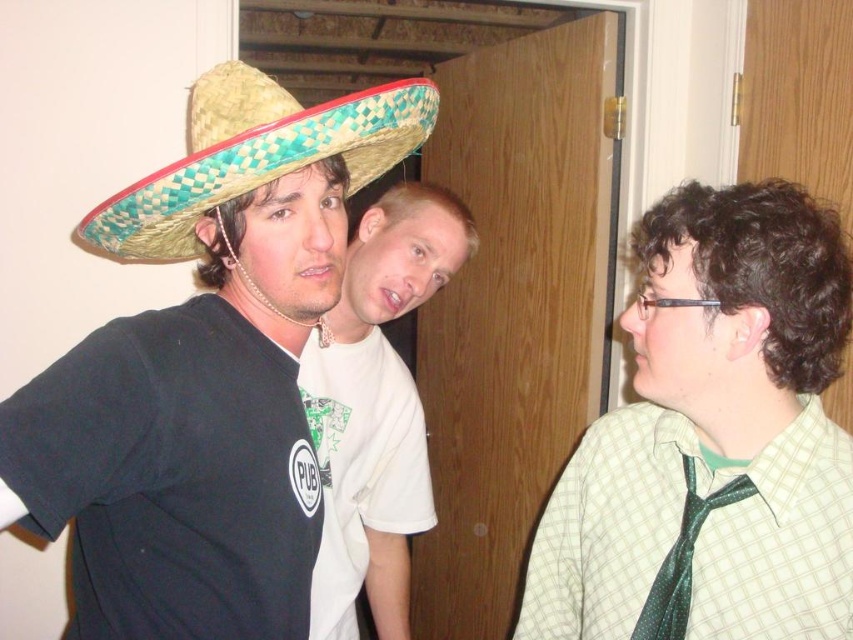
Between white cotton t-shirt at center and woven straw sombrero at upper left, which one is positioned lower?

white cotton t-shirt at center is below.

Can you confirm if white cotton t-shirt at center is positioned to the right of woven straw sombrero at upper left?

Correct, you'll find white cotton t-shirt at center to the right of woven straw sombrero at upper left.

Which is in front, point (347, 621) or point (366, 160)?

Point (366, 160) is in front.

Locate an element on the screen. white cotton t-shirt at center is located at coordinates (376, 408).

Does green shiny tie at right appear over green dotted fabric tie at right?

Yes.

Image resolution: width=853 pixels, height=640 pixels. Find the location of `green shiny tie at right`. green shiny tie at right is located at coordinates (714, 435).

Can you confirm if woven straw sombrero at left is positioned below green dotted fabric tie at right?

Incorrect, woven straw sombrero at left is not positioned below green dotted fabric tie at right.

Does point (258, 576) lie in front of point (641, 632)?

Yes, point (258, 576) is closer to viewer.

The width and height of the screenshot is (853, 640). In order to click on woven straw sombrero at left in this screenshot , I will do `click(206, 371)`.